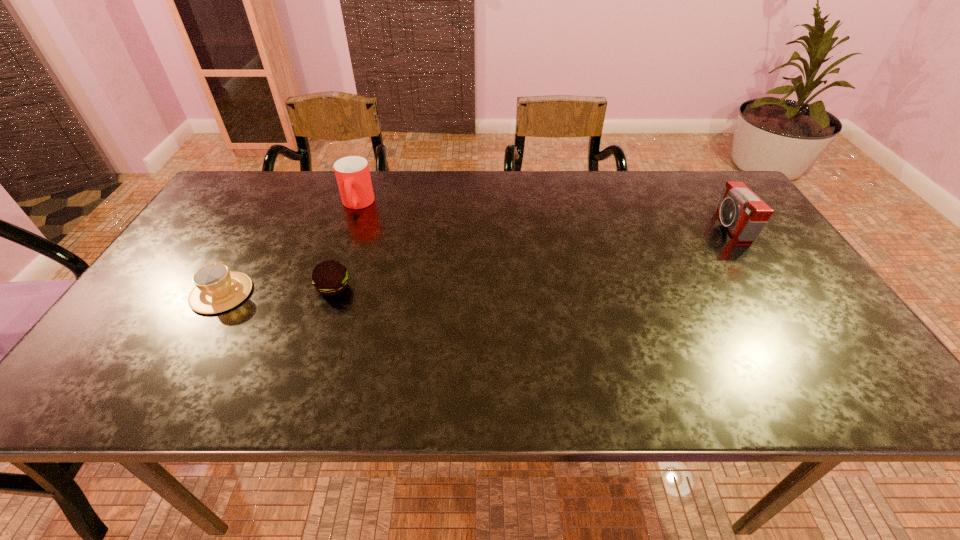
Image resolution: width=960 pixels, height=540 pixels. I want to click on the taller cup, so click(x=352, y=173).

What are the coordinates of `the right cup` in the screenshot? It's located at (352, 173).

The width and height of the screenshot is (960, 540). I want to click on the rightmost object, so click(x=745, y=215).

The image size is (960, 540). Find the location of `patty`. patty is located at coordinates (330, 278).

Locate an element on the screen. The image size is (960, 540). the nearer cup is located at coordinates (217, 290).

At what (x,y) coordinates should I click in order to perform the action: click on the shorter cup. Please return your answer as a coordinate pair (x, y). The width and height of the screenshot is (960, 540). Looking at the image, I should click on (217, 290).

The image size is (960, 540). Find the location of `blank space located on the side of the right cup with the handle`. blank space located on the side of the right cup with the handle is located at coordinates (330, 284).

You are a GUI agent. You are given a task and a screenshot of the screen. Output one action in this format:
    pyautogui.click(x=<x>, y=<y>)
    Task: Click on the blank space located 0.110m on the front-facing side of the rightmost object
    
    Given the screenshot: What is the action you would take?
    pyautogui.click(x=681, y=226)

You are a GUI agent. You are given a task and a screenshot of the screen. Output one action in this format:
    pyautogui.click(x=<x>, y=<y>)
    Task: Click on the vacant point located 0.290m on the front-facing side of the rightmost object
    This screenshot has height=540, width=960.
    Given the screenshot: What is the action you would take?
    pyautogui.click(x=616, y=226)

Find the location of a particular element. This screenshot has height=540, width=960. free space located 0.240m on the front-facing side of the rightmost object is located at coordinates (635, 226).